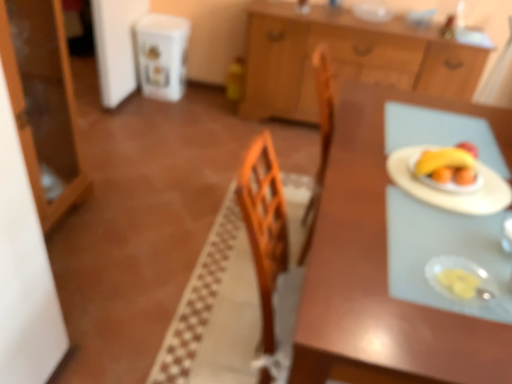
Identify the location of unoccupied region to the right of matte wood cabinet at left, the second cabinetry positioned from the right. The image size is (512, 384). (112, 223).